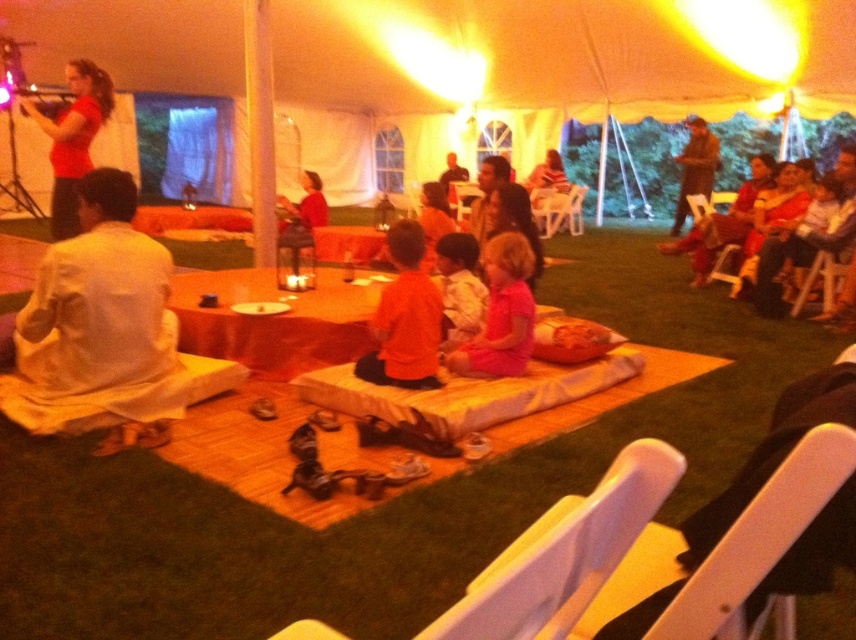
You are attending an outdoor evening event under a tent. You notice two people wearing a matte red shirt at upper left and a white cotton shirt at center. Which person is closer to you?

The matte red shirt at upper left is positioned over the white cotton shirt at center, so the person wearing the matte red shirt at upper left is closer to you.

You are a photographer standing outside the tent at the evening gathering. You want to capture a photo that includes both the matte red shirt at upper left and the white cotton shirt at center. Given that your camera has a maximum focus range of 2.5 meters, will you be able to include both subjects in the same frame without moving closer?

The distance between the matte red shirt at upper left and the white cotton shirt at center is 2.40 meters. Since your camera can focus up to 2.5 meters, both subjects can be included in the same frame as the distance is within the camera range.

You are a photographer at the event and want to capture both the orange cotton shirt at center and the pink matte dress at center in the same frame. Given that your camera has a minimum focus distance of 30 centimeters, will you be able to include both subjects in the shot?

The distance between the orange cotton shirt at center and the pink matte dress at center is 34.30 centimeters, which is greater than the camera minimum focus distance of 30 centimeters. Therefore, you can capture both subjects in the same frame.